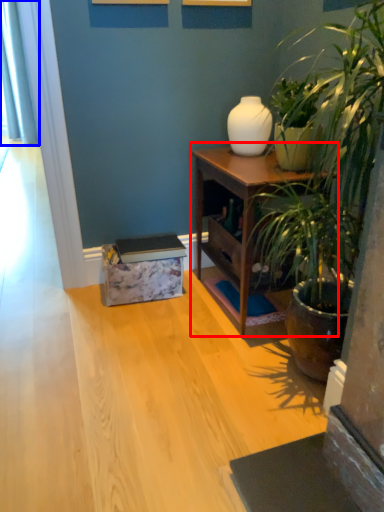
Question: Among these objects, which one is nearest to the camera, nightstand (highlighted by a red box) or curtain (highlighted by a blue box)?

Choices:
 (A) nightstand
 (B) curtain

Answer: (A)